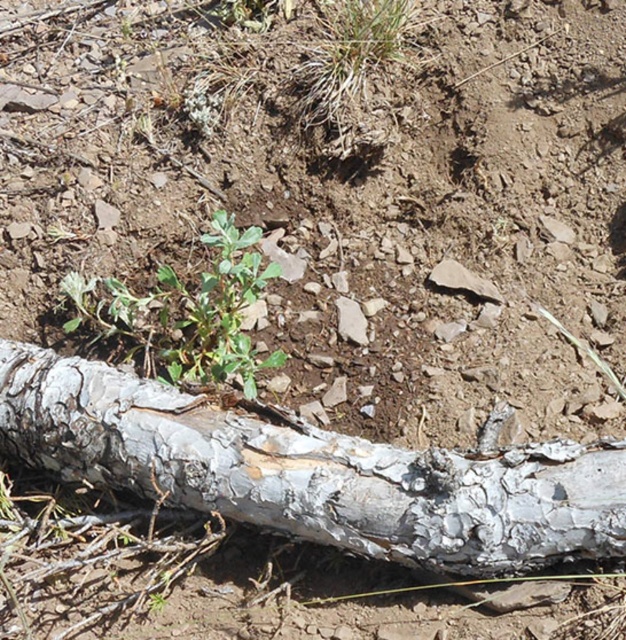
Who is lower down, gray rough bark log at center or green leafy plant at center?

Positioned lower is gray rough bark log at center.

Does gray rough bark log at center come behind green leafy plant at center?

No, it is in front of green leafy plant at center.

You are a GUI agent. You are given a task and a screenshot of the screen. Output one action in this format:
    pyautogui.click(x=<x>, y=<y>)
    Task: Click on the gray rough bark log at center
    This screenshot has width=626, height=640.
    Given the screenshot: What is the action you would take?
    pyautogui.click(x=314, y=472)